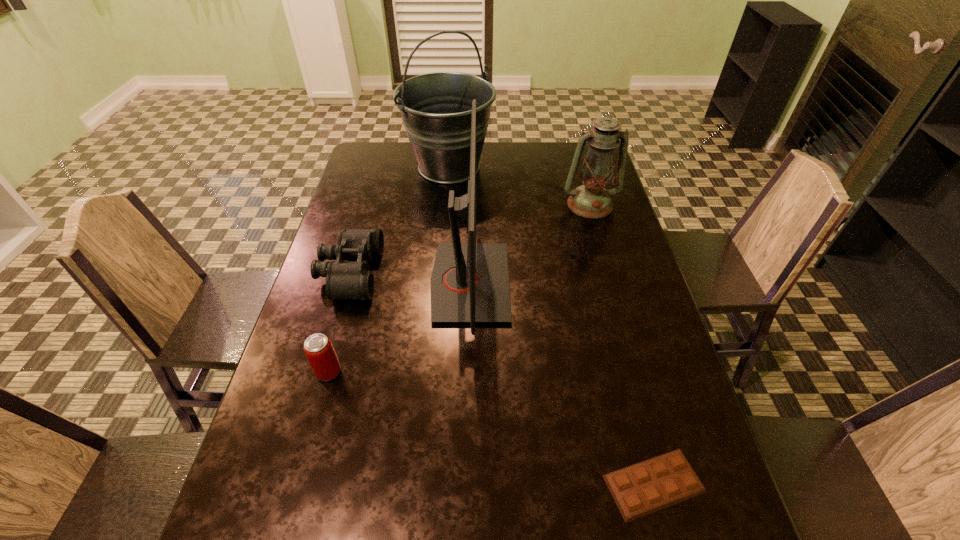
I want to click on bucket, so click(436, 108).

Locate an element on the screen. The width and height of the screenshot is (960, 540). monitor is located at coordinates coord(470,281).

Where is `oil lamp`? The width and height of the screenshot is (960, 540). oil lamp is located at coordinates (591, 200).

Image resolution: width=960 pixels, height=540 pixels. I want to click on beer can, so click(318, 348).

Where is `the second shortest object`? The height and width of the screenshot is (540, 960). the second shortest object is located at coordinates (344, 279).

You are a GUI agent. You are given a task and a screenshot of the screen. Output one action in this format:
    pyautogui.click(x=<x>, y=<y>)
    Task: Click on the shortest object
    Image resolution: width=960 pixels, height=540 pixels.
    Given the screenshot: What is the action you would take?
    pyautogui.click(x=646, y=487)

What are the coordinates of `chocolate bar` in the screenshot? It's located at (646, 487).

You are a GUI agent. You are given a task and a screenshot of the screen. Output one action in this format:
    pyautogui.click(x=<x>, y=<y>)
    Task: Click on the free space located on the front of the bucket
    
    Given the screenshot: What is the action you would take?
    pyautogui.click(x=444, y=223)

This screenshot has height=540, width=960. Identify the location of blank area located on the screen side of the monitor. (629, 282).

I want to click on vacant area situated on the left of the oil lamp, so click(x=529, y=205).